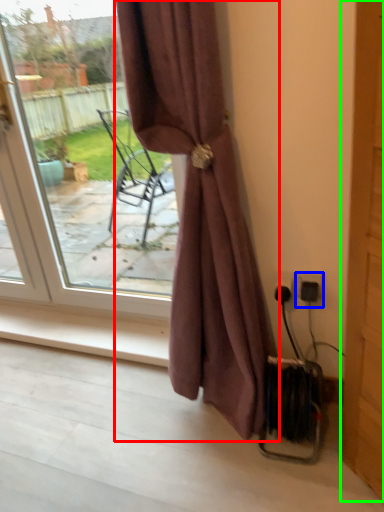
Question: Which is farther away from curtain (highlighted by a red box)? electric outlet (highlighted by a blue box) or screen door (highlighted by a green box)?

Choices:
 (A) electric outlet
 (B) screen door

Answer: (A)